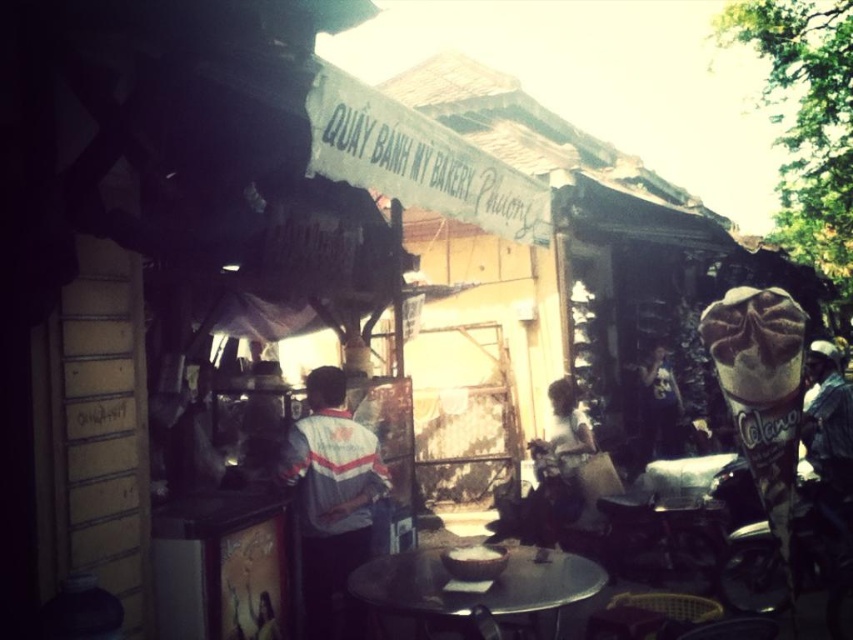
Question: Considering the relative positions of gray striped shirt at center and metallic round table at center in the image provided, where is gray striped shirt at center located with respect to metallic round table at center?

Choices:
 (A) above
 (B) below

Answer: (A)

Question: Which of the following is the closest to the observer?

Choices:
 (A) metallic round table at center
 (B) gray striped shirt at center

Answer: (A)

Question: Which point is closer to the camera?

Choices:
 (A) metallic round table at center
 (B) gray striped shirt at center

Answer: (A)

Question: Does gray striped shirt at center have a smaller size compared to metallic round table at center?

Choices:
 (A) yes
 (B) no

Answer: (B)

Question: Is gray striped shirt at center below metallic round table at center?

Choices:
 (A) yes
 (B) no

Answer: (B)

Question: Which object appears closest to the camera in this image?

Choices:
 (A) gray striped shirt at center
 (B) metallic round table at center

Answer: (B)